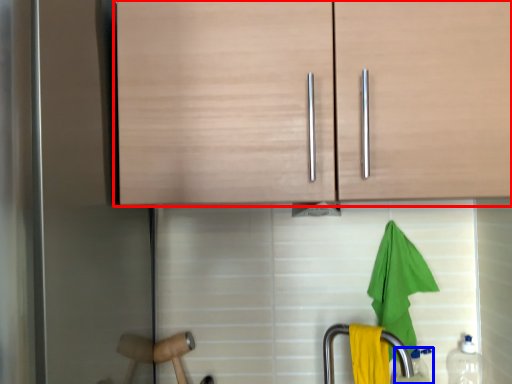
Question: Which of the following is the farthest to the observer, cabinetry (highlighted by a red box) or bottle (highlighted by a blue box)?

Choices:
 (A) cabinetry
 (B) bottle

Answer: (B)